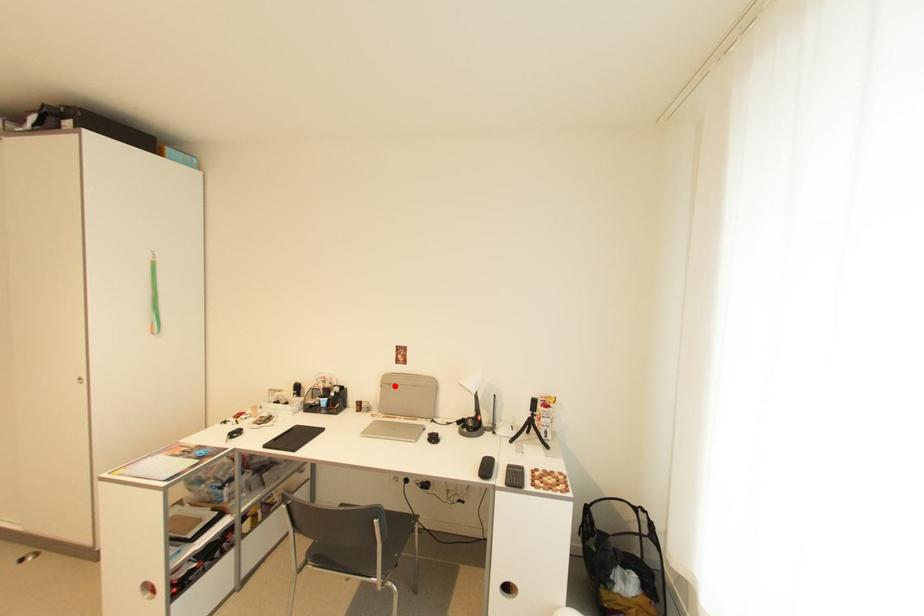
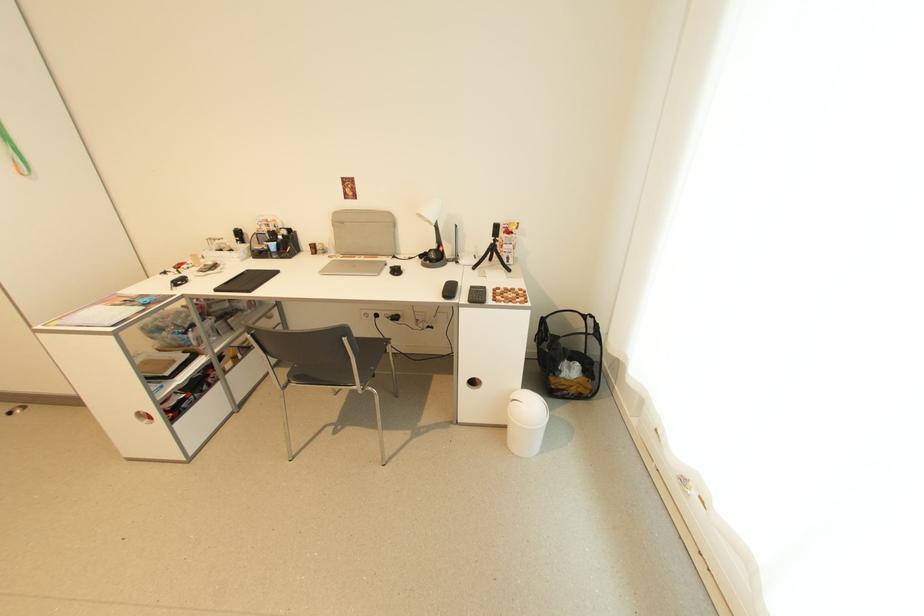
Where in the second image is the point corresponding to the highlighted location from the first image?

(347, 224)